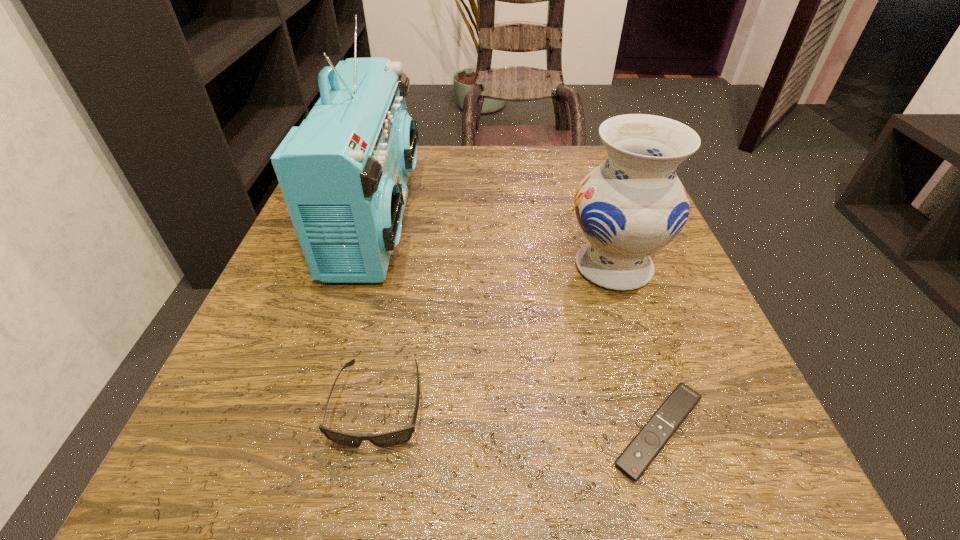
Identify the location of remote control situated at the near edge. [x=643, y=449].

Where is `radio receiver that is at the left edge`? radio receiver that is at the left edge is located at coordinates (343, 172).

Find the location of `sunglasses that is at the left edge`. sunglasses that is at the left edge is located at coordinates (397, 437).

At what (x,y) coordinates should I click in order to perform the action: click on vase that is at the right edge. Please return your answer as a coordinate pair (x, y). Looking at the image, I should click on (632, 205).

The image size is (960, 540). I want to click on remote control that is at the right edge, so click(x=643, y=449).

You are a GUI agent. You are given a task and a screenshot of the screen. Output one action in this format:
    pyautogui.click(x=<x>, y=<y>)
    Task: Click on the object at the far left corner
    The height and width of the screenshot is (540, 960).
    Given the screenshot: What is the action you would take?
    pyautogui.click(x=343, y=172)

What are the coordinates of `object situated at the near left corner` in the screenshot? It's located at (397, 437).

Image resolution: width=960 pixels, height=540 pixels. I want to click on object present at the near right corner, so click(x=643, y=449).

In the image, there is a desktop. Identify the location of free space at the far edge. (433, 174).

The image size is (960, 540). I want to click on vacant position at the near left corner of the desktop, so click(264, 467).